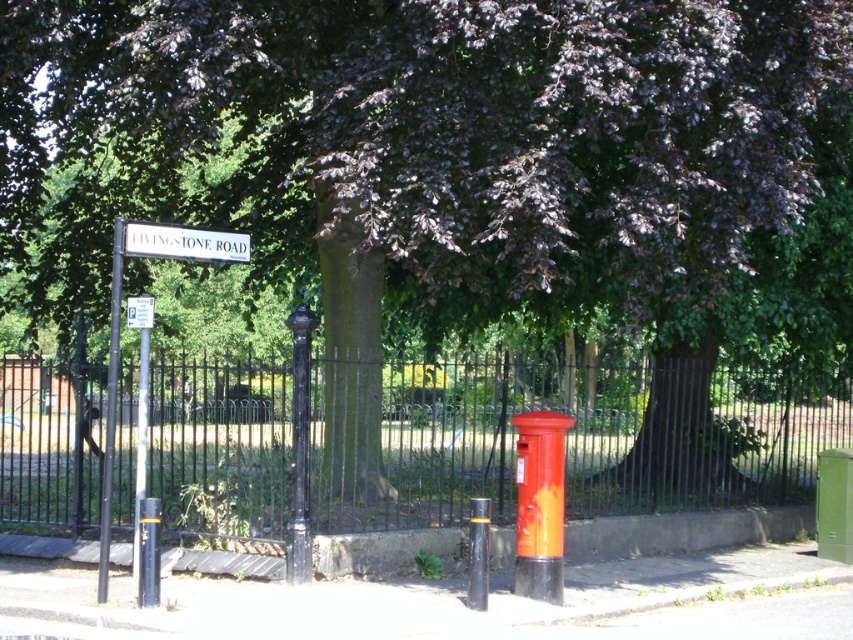
Consider the image. Between black polished metal pole at center and black metal pole at left, which one is positioned lower?

black metal pole at left

Who is more distant from viewer, [306,442] or [113,280]?

Point [306,442]

Find the location of a particular element. black polished metal pole at center is located at coordinates (300, 445).

Looking at this image, which of these two, brushed metal signpost at left or white plastic parking sign at upper left, stands taller?

With more height is brushed metal signpost at left.

Can you confirm if brushed metal signpost at left is positioned below white plastic parking sign at upper left?

Correct, brushed metal signpost at left is located below white plastic parking sign at upper left.

Is point (136, 552) farther from viewer compared to point (140, 307)?

Yes, it is.

Locate an element on the screen. The height and width of the screenshot is (640, 853). brushed metal signpost at left is located at coordinates (140, 449).

Who is shorter, black metal fence at center or white plastic street sign at upper left?

black metal fence at center

Which is more to the left, black metal fence at center or white plastic street sign at upper left?

white plastic street sign at upper left is more to the left.

You are a GUI agent. You are given a task and a screenshot of the screen. Output one action in this format:
    pyautogui.click(x=<x>, y=<y>)
    Task: Click on the black metal fence at center
    
    Given the screenshot: What is the action you would take?
    pyautogui.click(x=567, y=438)